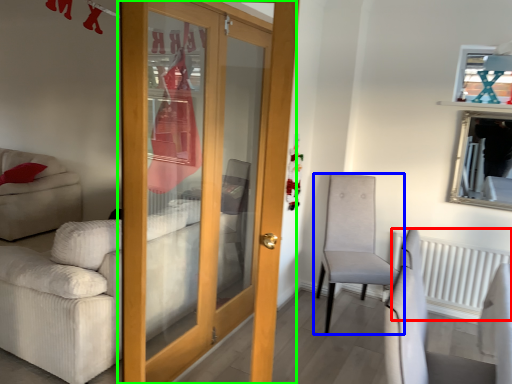
Question: Based on their relative distances, which object is farther from radiator (highlighted by a red box)? Choose from chair (highlighted by a blue box) and door (highlighted by a green box).

Choices:
 (A) chair
 (B) door

Answer: (B)